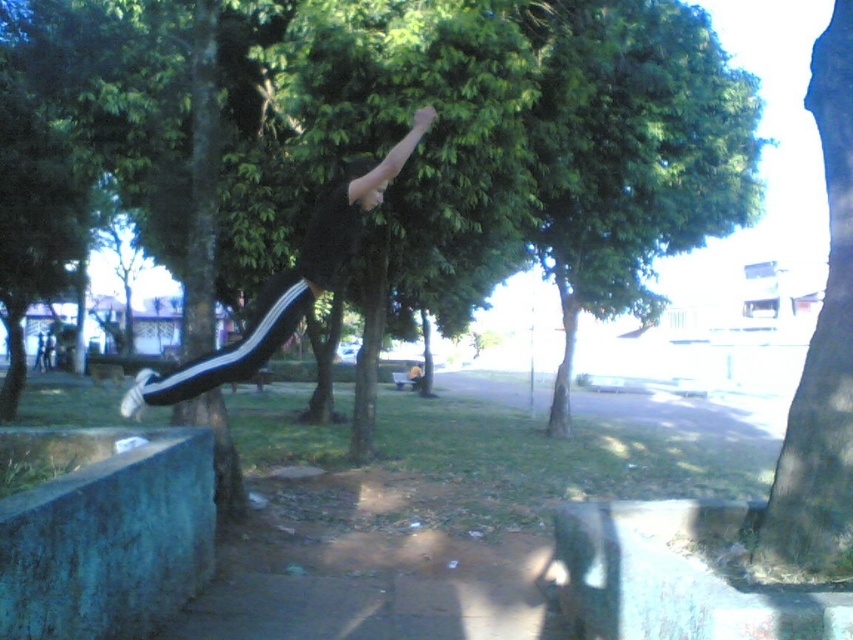
You are planning to set up a picnic blanket in the park. You want to choose a spot that is shaded by both the green leafy tree at center and the green leafy tree at right. Is this possible?

The green leafy tree at center is much taller than the green leafy tree at right, so their combined shade might overlap depending on their positions. However, since the description only mentions height and not horizontal distance, it is uncertain if their shadows would overlap sufficiently for a shared shaded area.

You are a photographer trying to capture the person performing the trick. Since the black matte track pants at center and the green leafy tree at center are both in the frame, which object should you focus on first to ensure the person is sharp? Explain your reasoning based on their positions.

You should focus on the green leafy tree at center first because the black matte track pants at center is behind it. By focusing on the tree, you ensure that the pants, being closer to the background, will also be in focus if the depth of field is sufficient. Alternatively, focusing on the pants might leave the tree out of focus if they are at different distances.

You are a photographer aiming to capture the black matte track pants at center and the green leafy tree at right in your shot. Based on their positions, which object is closer to the camera?

The green leafy tree at right is positioned under the black matte track pants at center, indicating that the green leafy tree at right is closer to the camera.